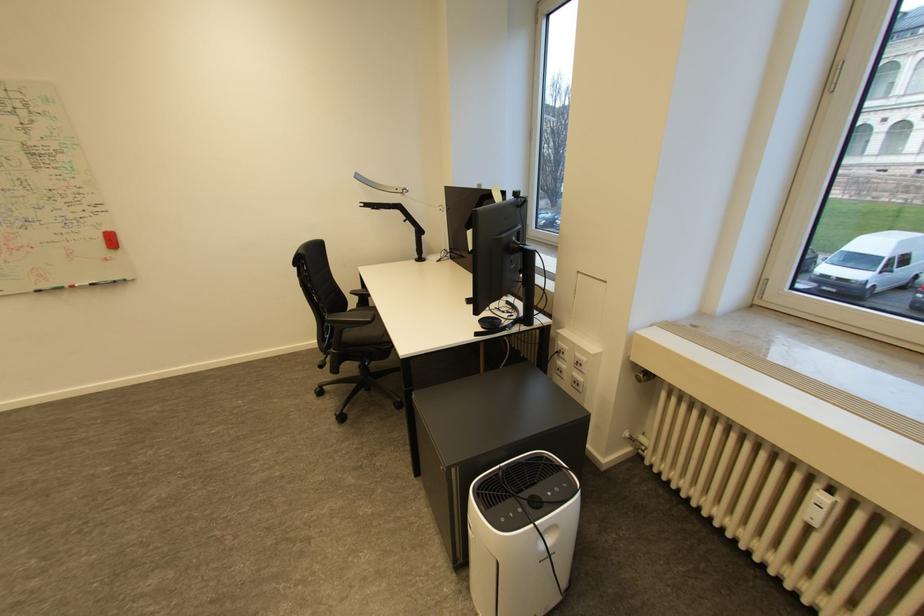
Where is `radiator control knob`? radiator control knob is located at coordinates (818, 508).